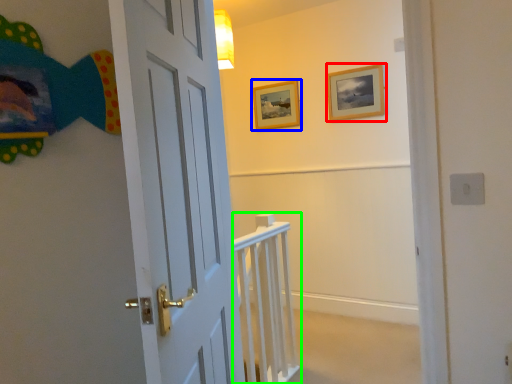
Question: Considering the real-world distances, which object is closest to picture frame (highlighted by a red box)? picture frame (highlighted by a blue box) or rail (highlighted by a green box).

Choices:
 (A) picture frame
 (B) rail

Answer: (A)